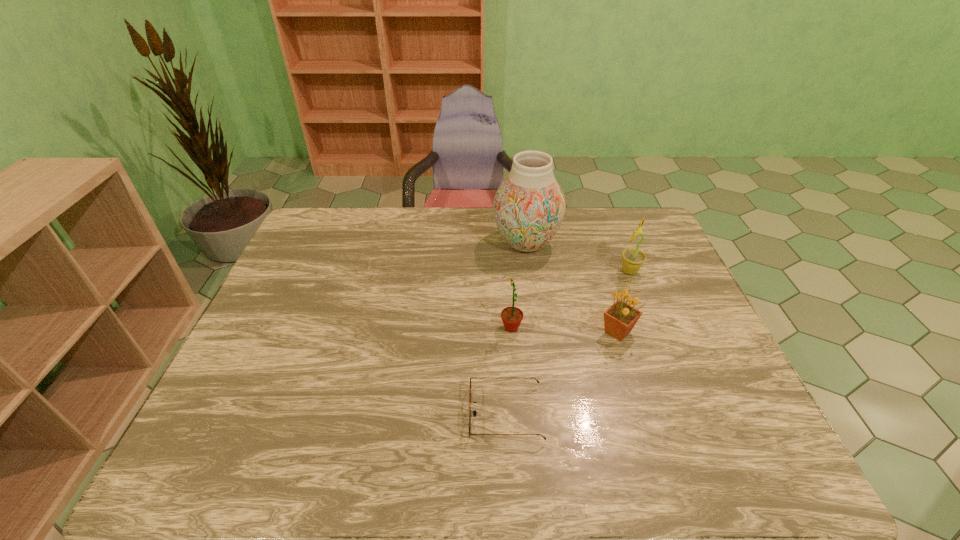
At what (x,y) coordinates should I click in order to perform the action: click on free region located on the face of the rightmost sunflower. Please return your answer as a coordinate pair (x, y). The width and height of the screenshot is (960, 540). Looking at the image, I should click on (496, 271).

In order to click on blank space located on the face of the leftmost sunflower in this screenshot , I will do `click(402, 328)`.

The height and width of the screenshot is (540, 960). What are the coordinates of `blank space located on the face of the leftmost sunflower` in the screenshot? It's located at (398, 328).

This screenshot has width=960, height=540. I want to click on free space located 0.190m on the face of the leftmost sunflower, so 428,328.

You are a GUI agent. You are given a task and a screenshot of the screen. Output one action in this format:
    pyautogui.click(x=<x>, y=<y>)
    Task: Click on the free space located at the front of the second sunflower from left to right with flowers visible
    Image resolution: width=960 pixels, height=540 pixels.
    Given the screenshot: What is the action you would take?
    pyautogui.click(x=643, y=413)

Find the location of a particular element. The height and width of the screenshot is (540, 960). blank space located 0.240m on the front-facing side of the shortest object is located at coordinates (362, 414).

You are a GUI agent. You are given a task and a screenshot of the screen. Output one action in this format:
    pyautogui.click(x=<x>, y=<y>)
    Task: Click on the blank area located on the front-facing side of the shortest object
    The width and height of the screenshot is (960, 540).
    Given the screenshot: What is the action you would take?
    pyautogui.click(x=295, y=414)

I want to click on vacant space located 0.290m on the front-facing side of the shortest object, so 339,414.

In order to click on object positioned at the far edge in this screenshot , I will do `click(529, 206)`.

You are a GUI agent. You are given a task and a screenshot of the screen. Output one action in this format:
    pyautogui.click(x=<x>, y=<y>)
    Task: Click on the object at the near edge
    This screenshot has height=540, width=960.
    Given the screenshot: What is the action you would take?
    pyautogui.click(x=474, y=412)